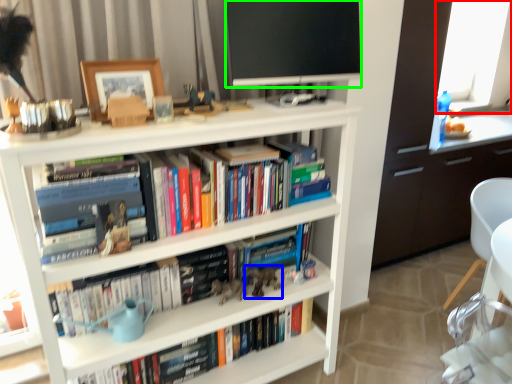
Question: Based on their relative distances, which object is nearer to window screen (highlighted by a red box)? Choose from toy (highlighted by a blue box) and television (highlighted by a green box).

Choices:
 (A) toy
 (B) television

Answer: (B)